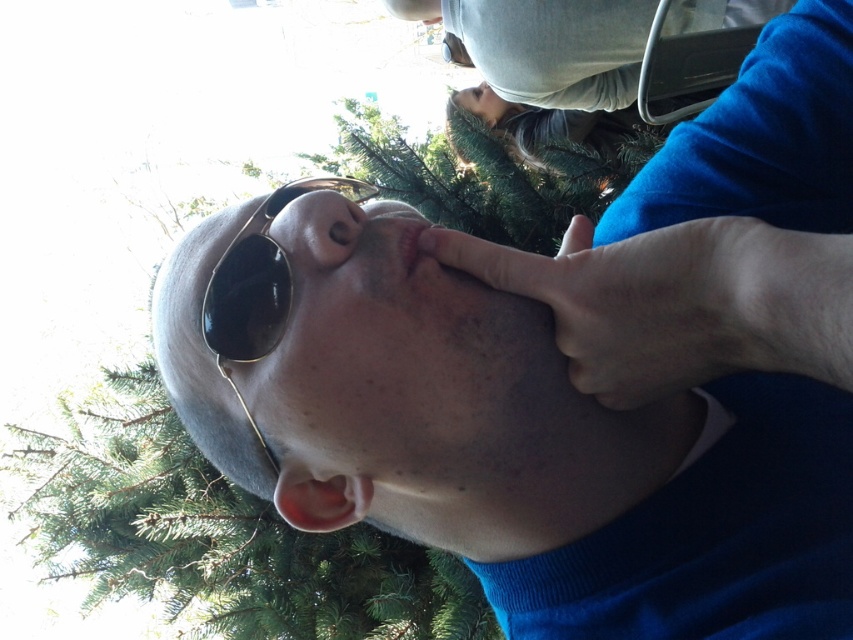
You are a photographer trying to capture a clear shot of the person wearing both matte black sunglasses at center and black metallic goggles at center. Since the image is rotated, you need to adjust your camera angle. Considering their heights, which object should you focus on first to ensure proper framing?

The matte black sunglasses at center has a greater height compared to the black metallic goggles at center, so you should focus on the matte black sunglasses at center first to ensure proper framing.